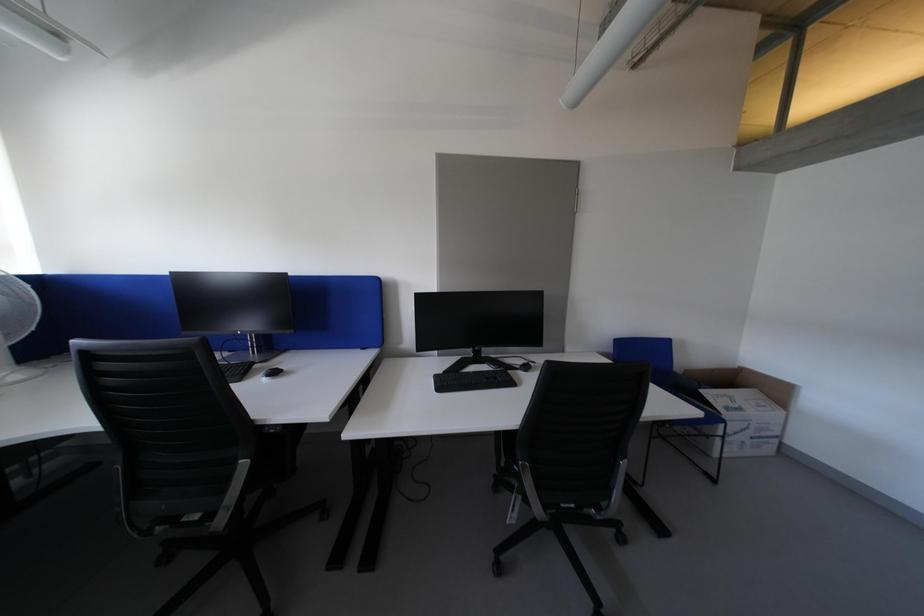
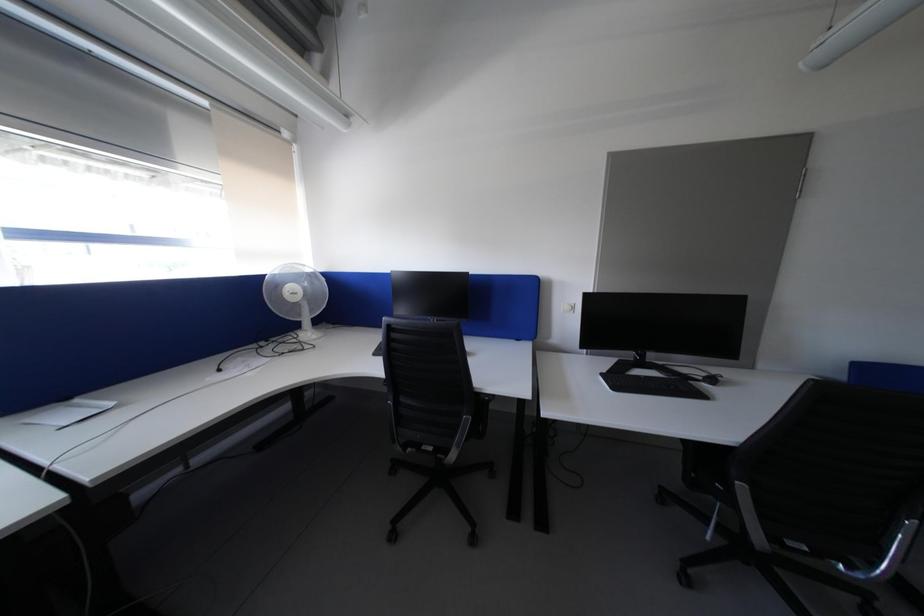
Question: The first image is from the beginning of the video and the second image is from the end. How did the camera likely rotate when shooting the video?

Choices:
 (A) Left
 (B) Right
 (C) Up
 (D) Down

Answer: (A)